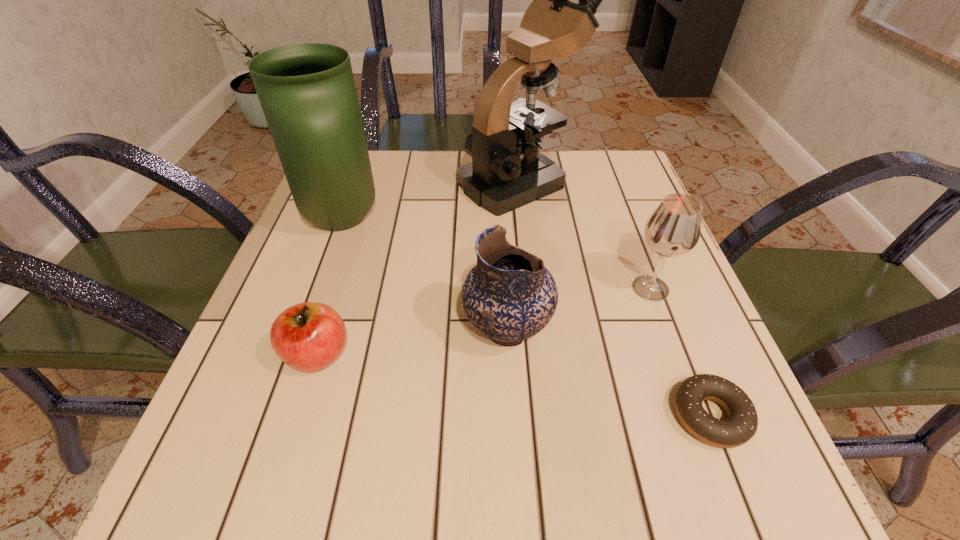
Identify the location of vacant space that's between the pottery and the vase. The height and width of the screenshot is (540, 960). (425, 275).

This screenshot has height=540, width=960. I want to click on free area in between the vase and the pottery, so click(x=425, y=275).

Find the location of a particular element. empty space that is in between the apple and the vase is located at coordinates (330, 288).

I want to click on vacant point located between the wineglass and the shortest object, so click(680, 352).

Where is `vacant space in between the doughnut and the pottery`? vacant space in between the doughnut and the pottery is located at coordinates (609, 373).

Find the location of `vacant area that lies between the microscope and the wineglass`. vacant area that lies between the microscope and the wineglass is located at coordinates (585, 235).

The width and height of the screenshot is (960, 540). Find the location of `empty space between the pottery and the second tallest object`. empty space between the pottery and the second tallest object is located at coordinates (425, 275).

Choose which object is the nearest neighbor to the pottery. Please provide its 2D coordinates. Your answer should be formatted as a tuple, i.e. [(x, y)], where the tuple contains the x and y coordinates of a point satisfying the conditions above.

[(673, 229)]

Find the location of a particular element. The width and height of the screenshot is (960, 540). object that is the closest to the vase is located at coordinates (507, 171).

This screenshot has height=540, width=960. In order to click on free space that satisfies the following two spatial constraints: 1. on the back side of the apple; 2. on the right side of the tallest object in this screenshot , I will do `click(371, 183)`.